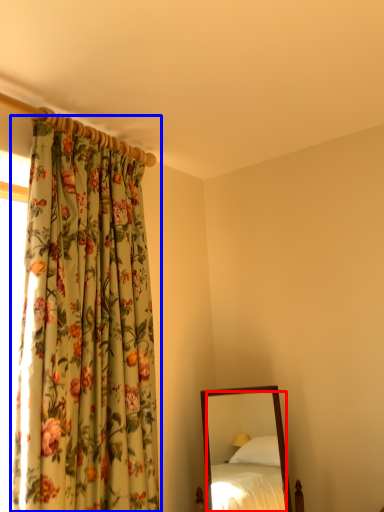
Question: Among these objects, which one is nearest to the camera, mirror (highlighted by a red box) or curtain (highlighted by a blue box)?

Choices:
 (A) mirror
 (B) curtain

Answer: (B)